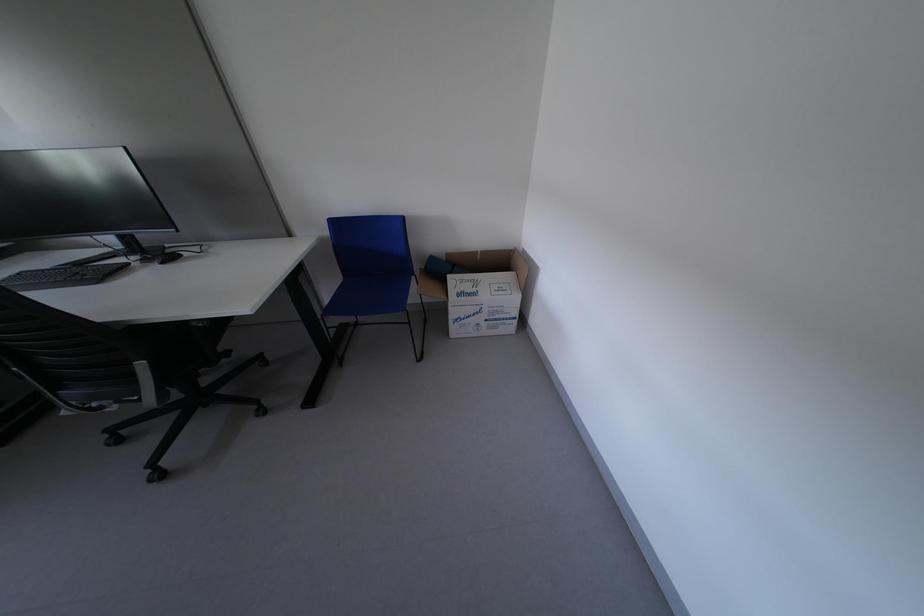
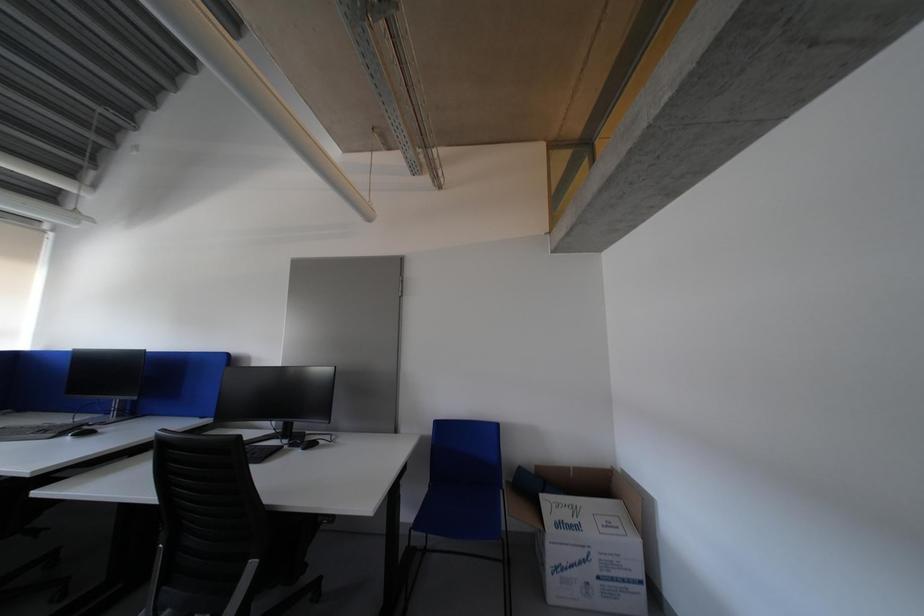
How did the camera likely rotate?

The camera rotated toward left-up.